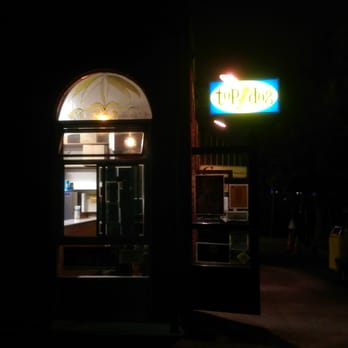
At what (x,y) coordinates should I click in order to perform the action: click on item on counter. Please return your answer as a coordinate pair (x, y). The height and width of the screenshot is (348, 348). Looking at the image, I should click on (76, 214).